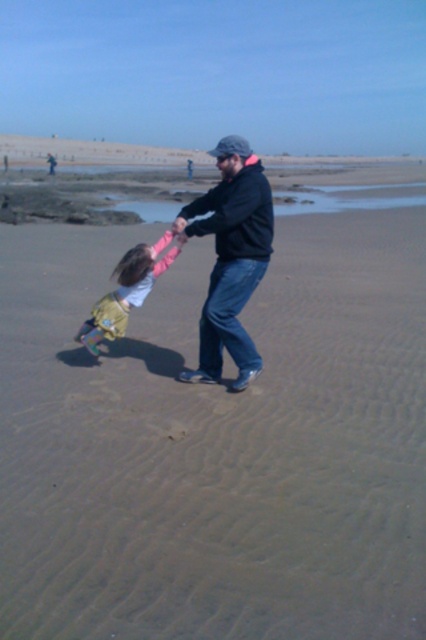
Consider the image. Does black matte jacket at center have a smaller size compared to light pink fabric dress at lower left?

No, black matte jacket at center is not smaller than light pink fabric dress at lower left.

Which is more to the left, black matte jacket at center or light pink fabric dress at lower left?

From the viewer's perspective, light pink fabric dress at lower left appears more on the left side.

Which is behind, point (213, 205) or point (123, 260)?

Point (123, 260)

Where is `black matte jacket at center`? black matte jacket at center is located at coordinates (230, 259).